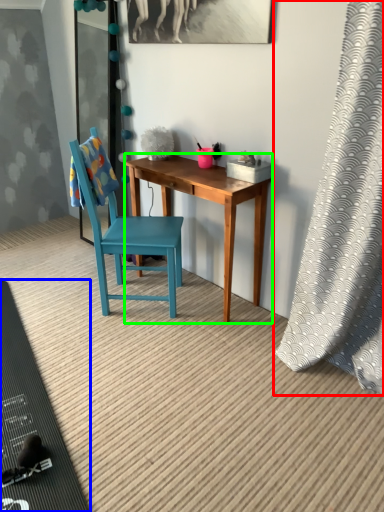
Question: Estimate the real-world distances between objects in this image. Which object is closer to curtain (highlighted by a red box), mat (highlighted by a blue box) or desk (highlighted by a green box)?

Choices:
 (A) mat
 (B) desk

Answer: (B)